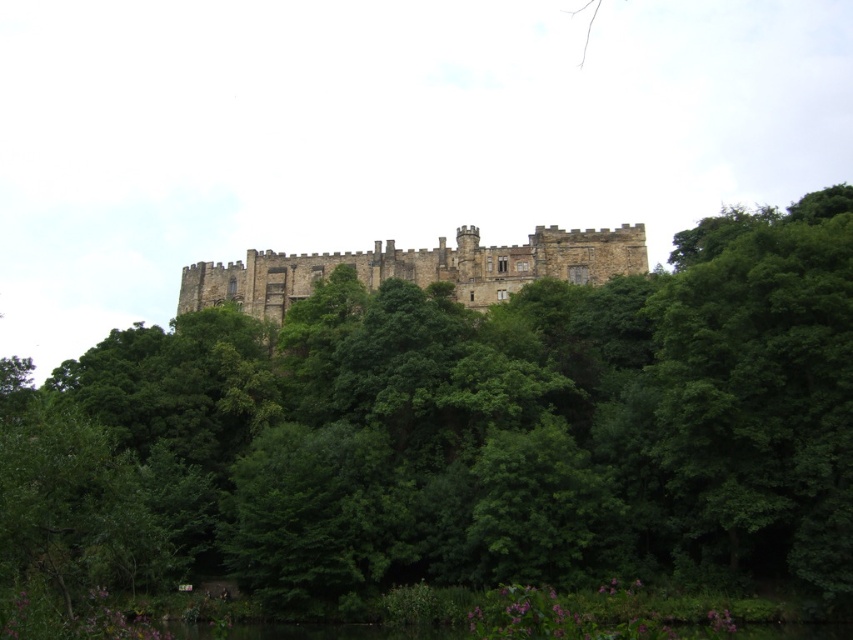
You are an architect planning to build a new garden path between the green leafy tree at center and the brown stone castle at center. Considering their widths, which one will require more space on the path?

The green leafy tree at center has a greater width than the brown stone castle at center, so it will require more space on the path.

You are a visitor standing at the base of the hill looking up at the brown stone castle at center and the green leafy tree at center. Which object is positioned to the right side from your viewpoint?

The green leafy tree at center is positioned to the right of the brown stone castle at center, so the green leafy tree at center is on the right side from your viewpoint.